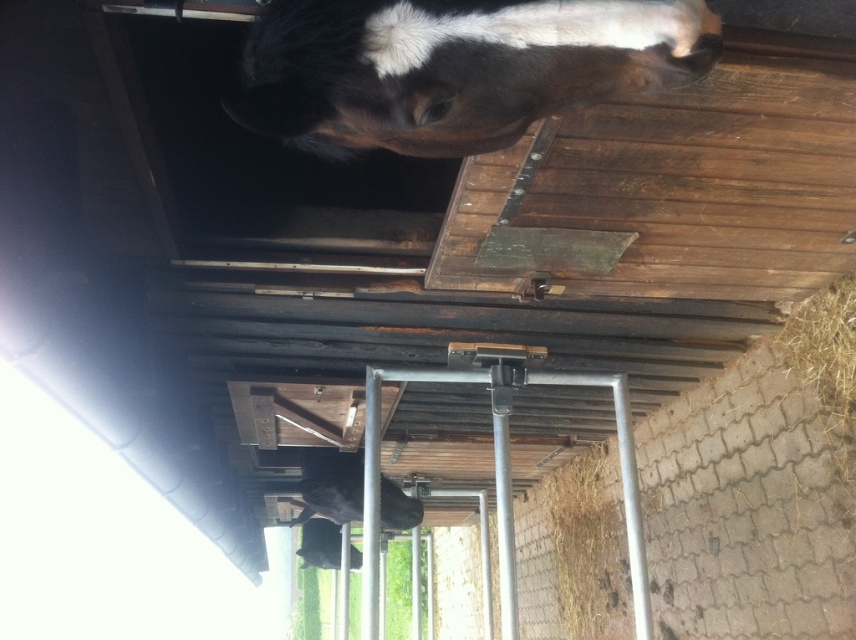
Can you confirm if black and white fur horse at upper center is bigger than black glossy horse at center?

Actually, black and white fur horse at upper center might be smaller than black glossy horse at center.

Does point (566, 44) lie behind point (402, 506)?

No, it is not.

Is point (342, 22) behind point (384, 518)?

No.

Locate an element on the screen. Image resolution: width=856 pixels, height=640 pixels. black and white fur horse at upper center is located at coordinates (455, 67).